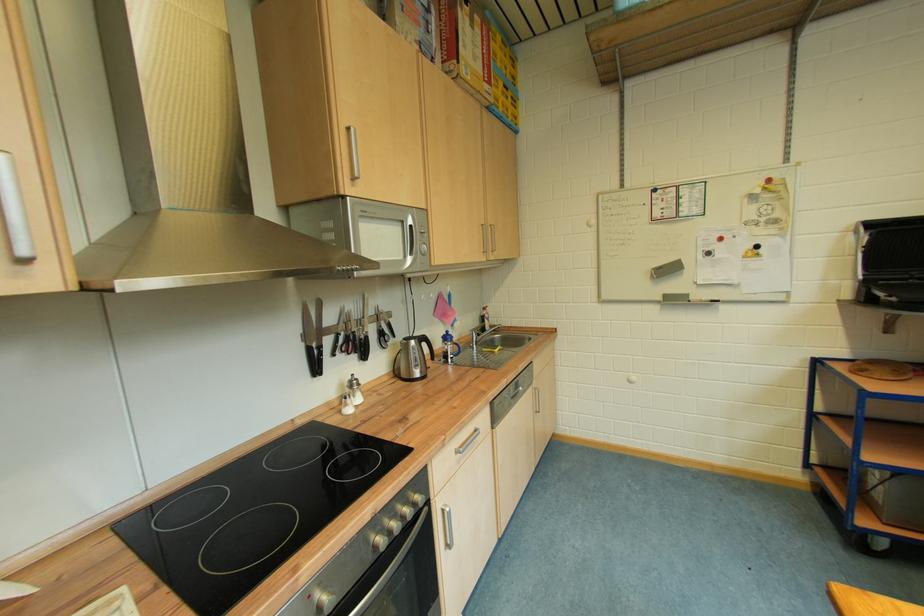
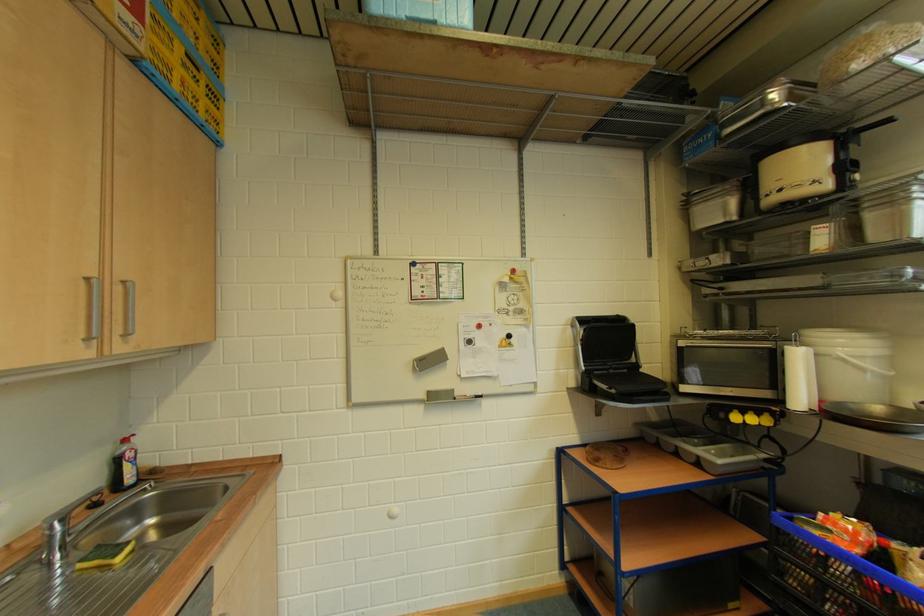
Question: I am providing you with two images of the same scene from different viewpoints. After the viewpoint changes to image2, which objects are now occluded?

Choices:
 (A) paper towel roll
 (B) faucet handle
 (C) black grill handle
 (D) none of these

Answer: (D)